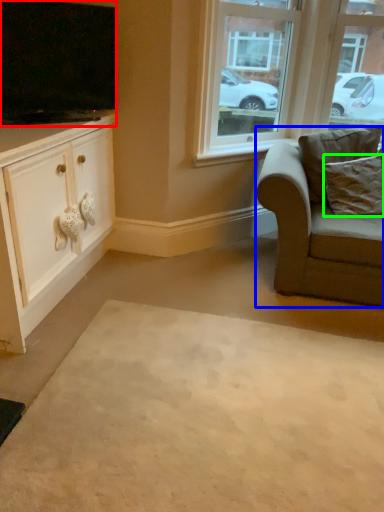
Question: Which object is the farthest from television (highlighted by a red box)? Choose among these: chair (highlighted by a blue box) or pillow (highlighted by a green box).

Choices:
 (A) chair
 (B) pillow

Answer: (B)